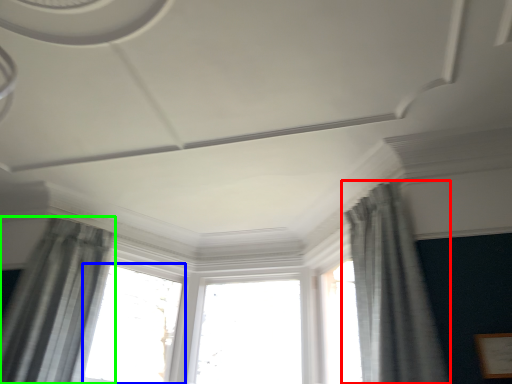
Question: Which object is positioned closest to curtain (highlighted by a red box)? Select from window (highlighted by a blue box) and curtain (highlighted by a green box).

Choices:
 (A) window
 (B) curtain

Answer: (A)